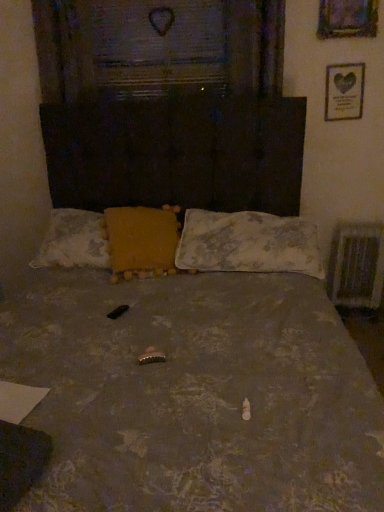
Question: Is there a large distance between yellow fabric pillow at center, acting as the 2th pillow starting from the right, and gold metallic picture frame at upper right, which appears as the 1th picture frame when ordered from the bottom?

Choices:
 (A) no
 (B) yes

Answer: (B)

Question: Can you confirm if yellow fabric pillow at center, placed as the first pillow when sorted from left to right, is smaller than gold metallic picture frame at upper right, arranged as the second picture frame when viewed from the front?

Choices:
 (A) yes
 (B) no

Answer: (B)

Question: From a real-world perspective, is yellow fabric pillow at center, acting as the 2th pillow starting from the right, positioned over gold metallic picture frame at upper right, the second picture frame when ordered from top to bottom, based on gravity?

Choices:
 (A) no
 (B) yes

Answer: (A)

Question: Is yellow fabric pillow at center, acting as the 2th pillow starting from the right, bigger than gold metallic picture frame at upper right, the second picture frame when ordered from top to bottom?

Choices:
 (A) no
 (B) yes

Answer: (B)

Question: From a real-world perspective, does yellow fabric pillow at center, acting as the 2th pillow starting from the right, sit lower than gold metallic picture frame at upper right, the second picture frame when ordered from top to bottom?

Choices:
 (A) yes
 (B) no

Answer: (A)

Question: Considering the positions of point (345, 34) and point (334, 93), is point (345, 34) closer or farther from the camera than point (334, 93)?

Choices:
 (A) farther
 (B) closer

Answer: (B)

Question: From the image's perspective, relative to gold metallic picture frame at upper right, arranged as the second picture frame when viewed from the front, is wooden picture frame at upper right, which ranks as the first picture frame in front-to-back order, above or below?

Choices:
 (A) below
 (B) above

Answer: (B)

Question: Is wooden picture frame at upper right, which is the second picture frame from back to front, situated inside gold metallic picture frame at upper right, arranged as the second picture frame when viewed from the front, or outside?

Choices:
 (A) inside
 (B) outside

Answer: (B)

Question: Looking at their shapes, would you say wooden picture frame at upper right, which is the second picture frame from back to front, is wider or thinner than gold metallic picture frame at upper right, which appears as the 1th picture frame when viewed from the back?

Choices:
 (A) wide
 (B) thin

Answer: (A)

Question: Considering the positions of yellow fabric pillow at center, acting as the 2th pillow starting from the right, and fluffy white pillow at center, arranged as the 2th pillow when viewed from the left, in the image, is yellow fabric pillow at center, acting as the 2th pillow starting from the right, wider or thinner than fluffy white pillow at center, arranged as the 2th pillow when viewed from the left,?

Choices:
 (A) thin
 (B) wide

Answer: (A)

Question: Is yellow fabric pillow at center, acting as the 2th pillow starting from the right, situated inside fluffy white pillow at center, acting as the first pillow starting from the right, or outside?

Choices:
 (A) outside
 (B) inside

Answer: (A)

Question: Is point click(x=117, y=270) positioned closer to the camera than point click(x=266, y=219)?

Choices:
 (A) farther
 (B) closer

Answer: (B)

Question: Looking at the image, does yellow fabric pillow at center, acting as the 2th pillow starting from the right, seem bigger or smaller compared to fluffy white pillow at center, arranged as the 2th pillow when viewed from the left?

Choices:
 (A) small
 (B) big

Answer: (A)

Question: Is wooden picture frame at upper right, positioned as the first picture frame in top-to-bottom order, situated inside yellow fabric pillow at center, placed as the first pillow when sorted from left to right, or outside?

Choices:
 (A) inside
 (B) outside

Answer: (B)

Question: From a real-world perspective, relative to yellow fabric pillow at center, acting as the 2th pillow starting from the right, is wooden picture frame at upper right, acting as the 2th picture frame starting from the bottom, vertically above or below?

Choices:
 (A) above
 (B) below

Answer: (A)